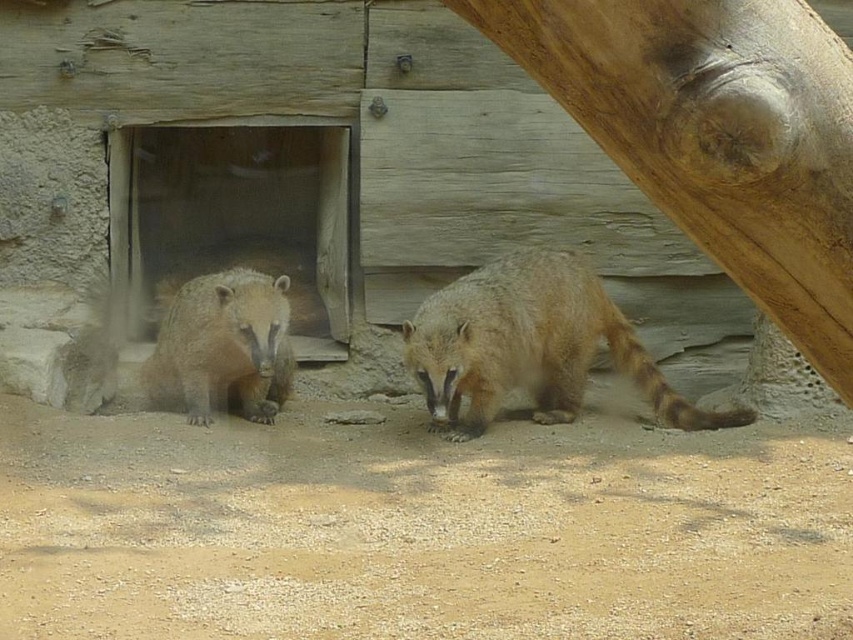
Can you confirm if smooth brown tree trunk at right is wider than fuzzy brown raccoon at center?

No.

Is point (793, 136) positioned after point (515, 365)?

No.

Is point (799, 340) farther from camera compared to point (521, 259)?

No.

You are a GUI agent. You are given a task and a screenshot of the screen. Output one action in this format:
    pyautogui.click(x=<x>, y=<y>)
    Task: Click on the smooth brown tree trunk at right
    
    Given the screenshot: What is the action you would take?
    pyautogui.click(x=717, y=134)

Can you confirm if fuzzy brown raccoon at center is positioned above fuzzy brown bear at center?

No, fuzzy brown raccoon at center is not above fuzzy brown bear at center.

Who is lower down, fuzzy brown raccoon at center or fuzzy brown bear at center?

fuzzy brown raccoon at center is below.

Who is more forward, (541, 396) or (270, 324)?

Point (270, 324) is more forward.

Identify the location of fuzzy brown raccoon at center. (531, 346).

Does smooth brown tree trunk at right have a greater width compared to fuzzy brown bear at center?

In fact, smooth brown tree trunk at right might be narrower than fuzzy brown bear at center.

Who is higher up, smooth brown tree trunk at right or fuzzy brown bear at center?

smooth brown tree trunk at right

What do you see at coordinates (717, 134) in the screenshot? Image resolution: width=853 pixels, height=640 pixels. I see `smooth brown tree trunk at right` at bounding box center [717, 134].

Locate an element on the screen. This screenshot has height=640, width=853. smooth brown tree trunk at right is located at coordinates (717, 134).